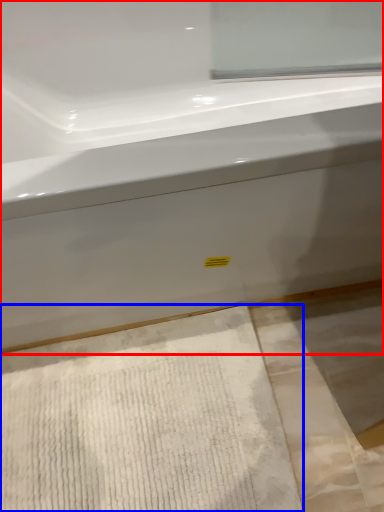
Question: Which point is closer to the camera, bathtub (highlighted by a red box) or bath mat (highlighted by a blue box)?

Choices:
 (A) bathtub
 (B) bath mat

Answer: (A)